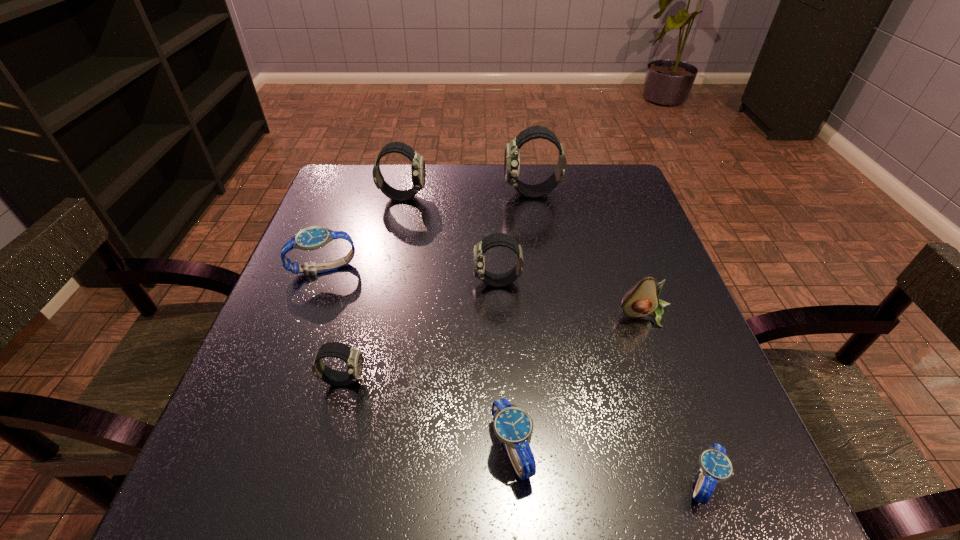
Identify which dark watch is the third nearest to the second smallest dark watch. Please provide its 2D coordinates. Your answer should be formatted as a tuple, i.e. [(x, y)], where the tuple contains the x and y coordinates of a point satisfying the conditions above.

[(418, 171)]

Where is `dark watch that can be found as the third closest to the second shortest watch`? Image resolution: width=960 pixels, height=540 pixels. dark watch that can be found as the third closest to the second shortest watch is located at coordinates (512, 151).

Locate which blue watch is the closest to the third farthest dark watch. Please provide its 2D coordinates. Your answer should be formatted as a tuple, i.e. [(x, y)], where the tuple contains the x and y coordinates of a point satisfying the conditions above.

[(311, 238)]

Where is `blue watch that is the second closest one to the tallest object`? blue watch that is the second closest one to the tallest object is located at coordinates (513, 426).

Find the location of `blank area in the image that satisfies the following two spatial constraints: 1. on the face of the seventh shortest object; 2. on the back side of the shortest object`. blank area in the image that satisfies the following two spatial constraints: 1. on the face of the seventh shortest object; 2. on the back side of the shortest object is located at coordinates (340, 481).

Where is `vacant area in the image that satisfies the following two spatial constraints: 1. on the face of the second shortest object; 2. on the right side of the smallest dark watch`? This screenshot has height=540, width=960. vacant area in the image that satisfies the following two spatial constraints: 1. on the face of the second shortest object; 2. on the right side of the smallest dark watch is located at coordinates click(x=325, y=449).

Locate an element on the screen. The width and height of the screenshot is (960, 540). free space in the image that satisfies the following two spatial constraints: 1. on the face of the second blue watch from right to left; 2. on the right side of the second tallest object is located at coordinates (348, 449).

You are a GUI agent. You are given a task and a screenshot of the screen. Output one action in this format:
    pyautogui.click(x=<x>, y=<y>)
    Task: Click on the free spot that satisfies the following two spatial constraints: 1. on the face of the rightmost watch; 2. on the left side of the third biggest dark watch
    The width and height of the screenshot is (960, 540).
    Given the screenshot: What is the action you would take?
    pyautogui.click(x=506, y=481)

The width and height of the screenshot is (960, 540). In order to click on free space in the image that satisfies the following two spatial constraints: 1. on the face of the shortest object; 2. on the right side of the tallest object in this screenshot , I will do `click(576, 481)`.

This screenshot has width=960, height=540. Identify the location of free location that satisfies the following two spatial constraints: 1. on the face of the second shortest watch; 2. on the right side of the third smallest dark watch. (348, 449).